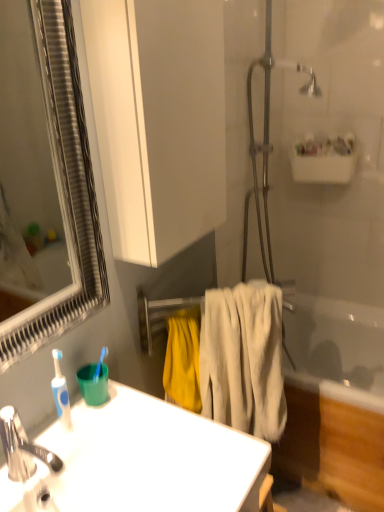
Question: Is polished chrome faucet at lower left bigger or smaller than white glossy sink at lower left?

Choices:
 (A) big
 (B) small

Answer: (B)

Question: From a real-world perspective, relative to white glossy sink at lower left, is polished chrome faucet at lower left vertically above or below?

Choices:
 (A) above
 (B) below

Answer: (A)

Question: Which is nearer to the silver-framed mirror at left?

Choices:
 (A) metallic silver towel rack at center
 (B) white fluffy towel at center
 (C) white matte cabinet at upper center
 (D) polished chrome faucet at lower left
 (E) white glossy sink at lower left

Answer: (B)

Question: Estimate the real-world distances between objects in this image. Which object is closer to the white matte cabinet at upper center?

Choices:
 (A) polished chrome faucet at lower left
 (B) white glossy sink at lower left
 (C) silver-framed mirror at left
 (D) white fluffy towel at center
 (E) metallic silver towel rack at center

Answer: (D)